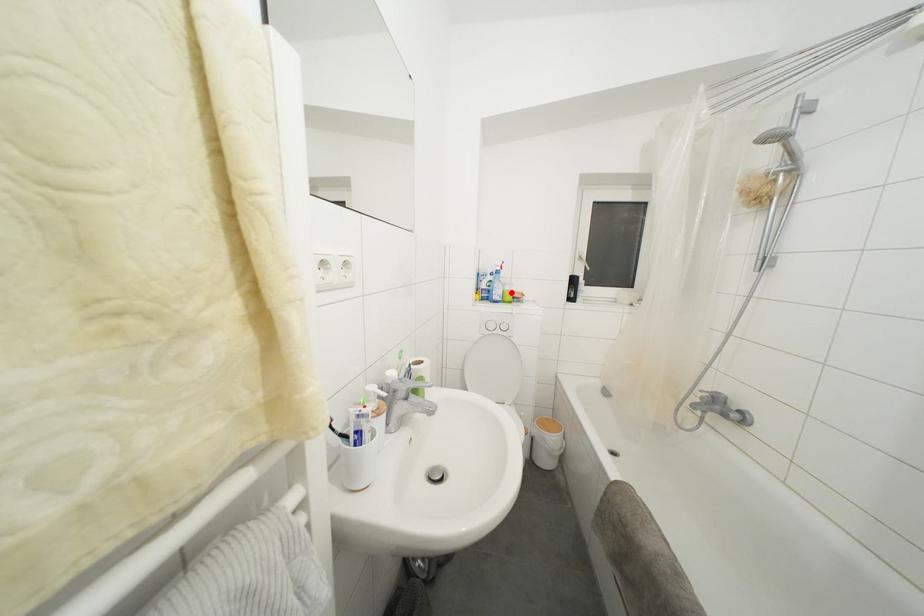
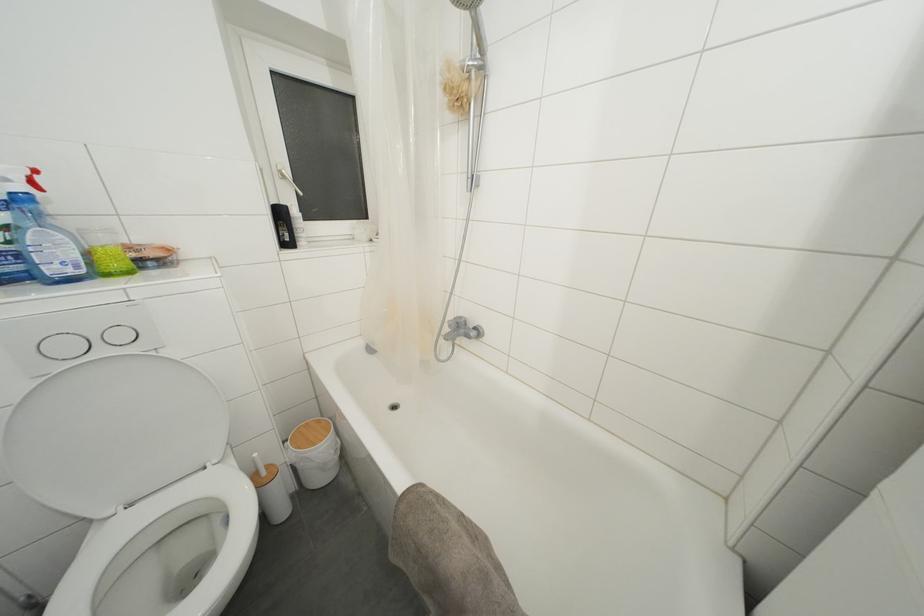
Locate, in the second image, the point that corresponds to the highlighted location in the first image.

(108, 245)